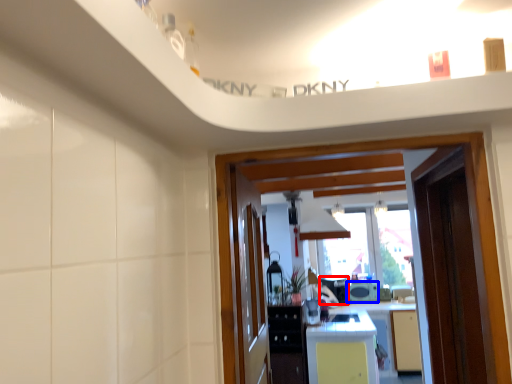
Question: Which point is further to the camera, appliance (highlighted by a red box) or appliance (highlighted by a blue box)?

Choices:
 (A) appliance
 (B) appliance

Answer: (B)